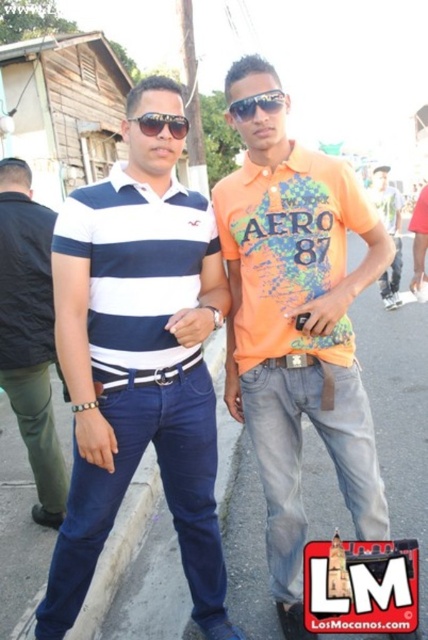
Is sunglasses at center to the left of matte black sunglasses at center from the viewer's perspective?

Incorrect, sunglasses at center is not on the left side of matte black sunglasses at center.

The height and width of the screenshot is (640, 428). I want to click on sunglasses at center, so coord(256,104).

Is matte striped polo shirt at left above matte black sunglasses at center?

Incorrect, matte striped polo shirt at left is not positioned above matte black sunglasses at center.

Is matte striped polo shirt at left thinner than matte black sunglasses at center?

No.

Does point (77, 392) lie behind point (171, 124)?

No.

Identify the location of matte striped polo shirt at left. Image resolution: width=428 pixels, height=640 pixels. tap(139, 362).

Consider the image. Is matte striped polo shirt at left in front of orange printed t-shirt at center?

Yes, it is.

Between matte striped polo shirt at left and orange printed t-shirt at center, which one appears on the right side from the viewer's perspective?

From the viewer's perspective, orange printed t-shirt at center appears more on the right side.

This screenshot has width=428, height=640. Identify the location of matte striped polo shirt at left. (139, 362).